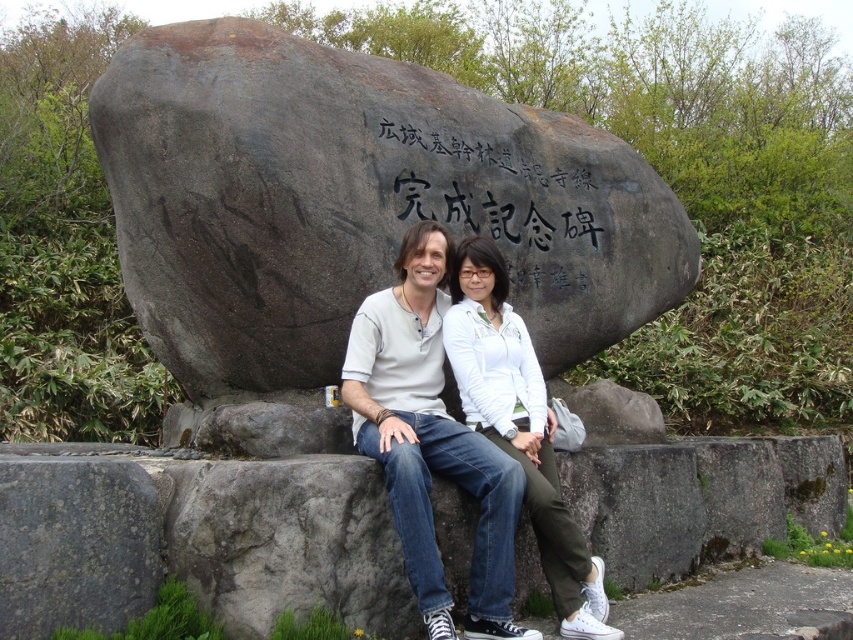
Question: Considering the real-world distances, which object is closest to the dark gray stone boulder at center?

Choices:
 (A) matte white shirt at center
 (B) black stone engraving at center
 (C) gray rough stone at lower left

Answer: (B)

Question: Which object is the farthest from the matte white shirt at center?

Choices:
 (A) black stone engraving at center
 (B) dark gray stone boulder at center

Answer: (B)

Question: Does matte white shirt at center have a smaller size compared to black stone engraving at center?

Choices:
 (A) no
 (B) yes

Answer: (A)

Question: Which point is closer to the camera taking this photo?

Choices:
 (A) (408, 212)
 (B) (61, 596)
 (C) (490, 477)

Answer: (B)

Question: Is matte white shirt at center closer to camera compared to black stone engraving at center?

Choices:
 (A) no
 (B) yes

Answer: (B)

Question: Does dark gray stone boulder at center appear on the left side of gray rough stone at lower left?

Choices:
 (A) no
 (B) yes

Answer: (A)